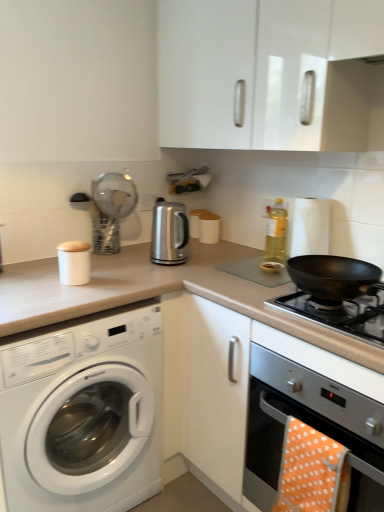
Where is `free point in front of satin silver kettle at center, which is counted as the 2th appliance, starting from the right`? The image size is (384, 512). free point in front of satin silver kettle at center, which is counted as the 2th appliance, starting from the right is located at coordinates (172, 271).